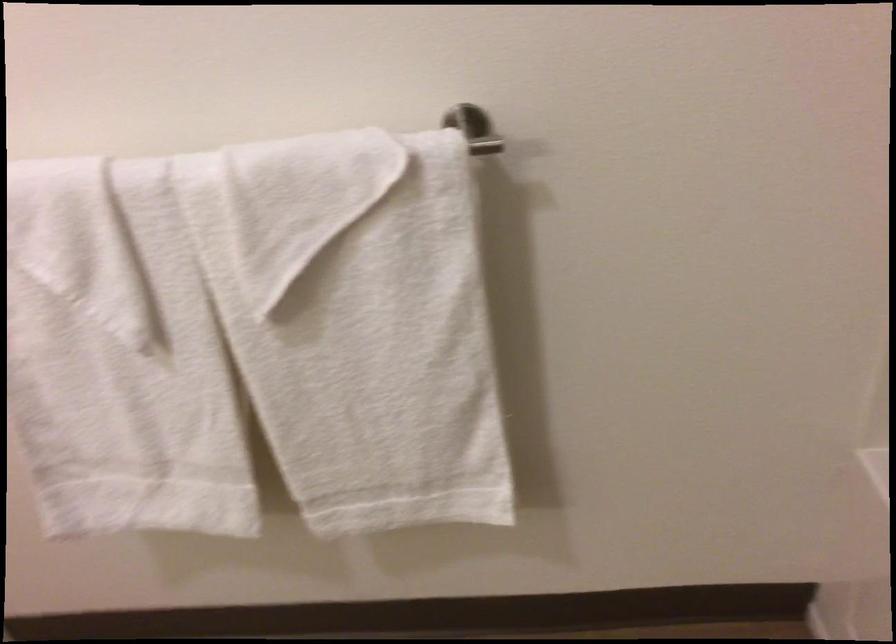
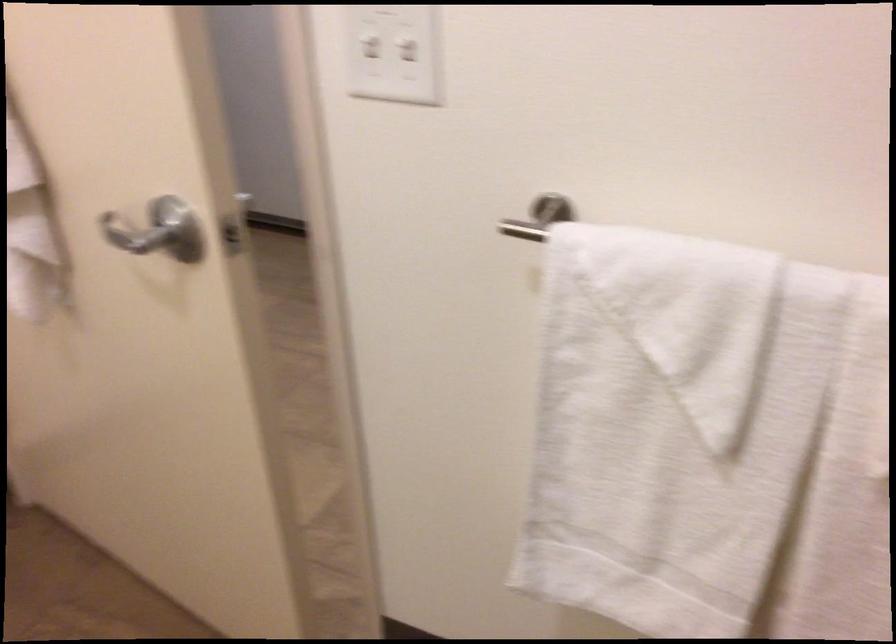
Question: Based on the continuous images, in which direction is the camera rotating? Reply with the corresponding letter.

Choices:
 (A) Left
 (B) Right
 (C) Up
 (D) Down

Answer: (A)